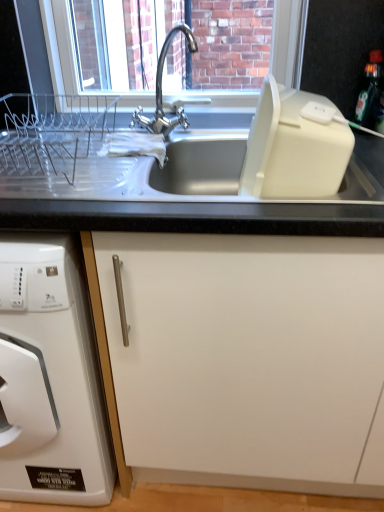
Question: In the image, is white plastic dish rack at left positioned in front of or behind black glossy bottle at upper right?

Choices:
 (A) front
 (B) behind

Answer: (A)

Question: From the image's perspective, is white plastic dish rack at left positioned above or below black glossy bottle at upper right?

Choices:
 (A) below
 (B) above

Answer: (A)

Question: Which is farther from the white matte cabinet at center?

Choices:
 (A) white plastic dish rack at left
 (B) chrome metallic faucet at upper center
 (C) clear glass window screen at upper center
 (D) black glossy bottle at upper right

Answer: (C)

Question: Based on their relative distances, which object is nearer to the white plastic dish rack at left?

Choices:
 (A) black glossy bottle at upper right
 (B) chrome metallic faucet at upper center
 (C) clear glass window screen at upper center
 (D) white matte cabinet at center

Answer: (D)